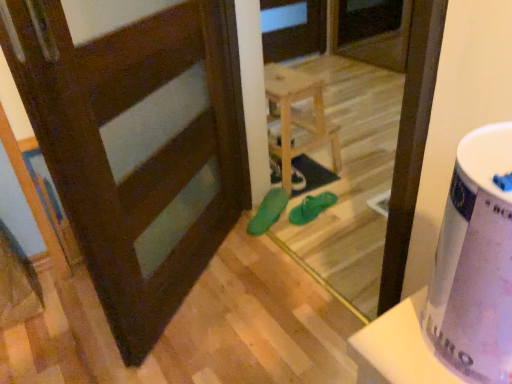
This screenshot has width=512, height=384. Find the location of `free space to the right of light wood stool at center`. free space to the right of light wood stool at center is located at coordinates (362, 167).